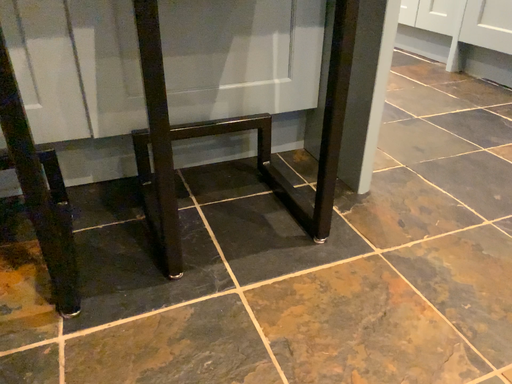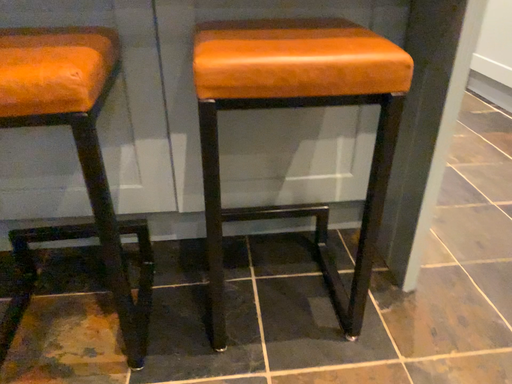
Question: Which way did the camera rotate in the video?

Choices:
 (A) rotated right
 (B) rotated left

Answer: (B)